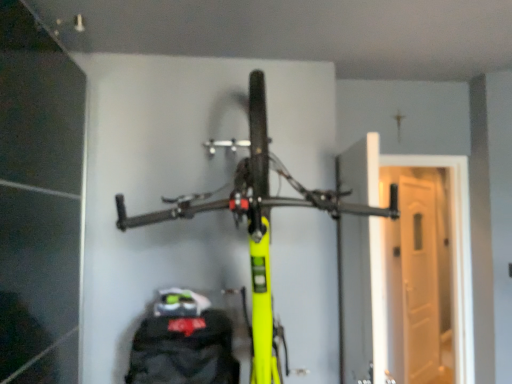
The image size is (512, 384). What do you see at coordinates (407, 268) in the screenshot? I see `white glossy door at right` at bounding box center [407, 268].

Where is `white glossy door at right`? The height and width of the screenshot is (384, 512). white glossy door at right is located at coordinates (407, 268).

Image resolution: width=512 pixels, height=384 pixels. Describe the element at coordinates (258, 219) in the screenshot. I see `neon yellow bike at center` at that location.

Identify the location of neon yellow bike at center. The image size is (512, 384). (258, 219).

Identify the location of white glossy door at right. This screenshot has height=384, width=512. (407, 268).

Which is more to the left, white glossy door at right or neon yellow bike at center?

neon yellow bike at center is more to the left.

Which object is closer to the camera, white glossy door at right or neon yellow bike at center?

neon yellow bike at center.

Is point (420, 359) positioned after point (272, 156)?

Yes, point (420, 359) is behind point (272, 156).

From the image's perspective, which is below, white glossy door at right or neon yellow bike at center?

white glossy door at right.

From a real-world perspective, is white glossy door at right positioned above or below neon yellow bike at center?

white glossy door at right is below neon yellow bike at center.

Considering the relative sizes of white glossy door at right and neon yellow bike at center in the image provided, is white glossy door at right thinner than neon yellow bike at center?

Yes, white glossy door at right is thinner than neon yellow bike at center.

Considering the sizes of white glossy door at right and neon yellow bike at center in the image, is white glossy door at right taller or shorter than neon yellow bike at center?

white glossy door at right is shorter than neon yellow bike at center.

Who is smaller, white glossy door at right or neon yellow bike at center?

Smaller between the two is white glossy door at right.

From the picture: Is white glossy door at right completely or partially outside of neon yellow bike at center?

Absolutely, white glossy door at right is external to neon yellow bike at center.

Would you consider white glossy door at right to be distant from neon yellow bike at center?

Yes, white glossy door at right and neon yellow bike at center are quite far apart.

Is white glossy door at right facing towards neon yellow bike at center?

No, white glossy door at right is not turned towards neon yellow bike at center.

How far apart are white glossy door at right and neon yellow bike at center?

white glossy door at right is 7.35 feet away from neon yellow bike at center.

This screenshot has width=512, height=384. I want to click on bicycle lying on the left of white glossy door at right, so click(258, 219).

Considering the relative positions of neon yellow bike at center and white glossy door at right in the image provided, is neon yellow bike at center to the right of white glossy door at right from the viewer's perspective?

Incorrect, neon yellow bike at center is not on the right side of white glossy door at right.

Which is in front, neon yellow bike at center or white glossy door at right?

neon yellow bike at center.

Does point (261, 85) come farther from viewer compared to point (420, 348)?

No, (261, 85) is closer to viewer.

Looking at this image, from the image's perspective, which is below, neon yellow bike at center or white glossy door at right?

white glossy door at right is shown below in the image.

From a real-world perspective, between neon yellow bike at center and white glossy door at right, who is vertically higher?

In real-world perspective, neon yellow bike at center is above.

Which of these two, neon yellow bike at center or white glossy door at right, is wider?

With larger width is neon yellow bike at center.

Which of these two, neon yellow bike at center or white glossy door at right, stands shorter?

Standing shorter between the two is white glossy door at right.

Consider the image. Does neon yellow bike at center have a larger size compared to white glossy door at right?

Yes, neon yellow bike at center is bigger than white glossy door at right.

Could white glossy door at right be considered to be inside neon yellow bike at center?

Definitely not — white glossy door at right is not inside neon yellow bike at center.

Is neon yellow bike at center far from white glossy door at right?

neon yellow bike at center is positioned a significant distance from white glossy door at right.

From the picture: Could you tell me if neon yellow bike at center is facing white glossy door at right?

No, neon yellow bike at center is not oriented towards white glossy door at right.

Find the location of a particular element. garage door that is behind the neon yellow bike at center is located at coordinates pyautogui.click(x=407, y=268).

This screenshot has width=512, height=384. I want to click on garage door that is below the neon yellow bike at center (from the image's perspective), so [407, 268].

At what (x,y) coordinates should I click in order to perform the action: click on garage door located underneath the neon yellow bike at center (from a real-world perspective). Please return your answer as a coordinate pair (x, y). Looking at the image, I should click on (407, 268).